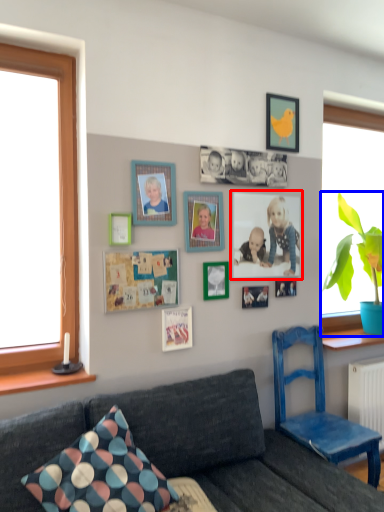
Question: Which object appears closest to the camera in this image, picture frame (highlighted by a red box) or houseplant (highlighted by a blue box)?

Choices:
 (A) picture frame
 (B) houseplant

Answer: (A)